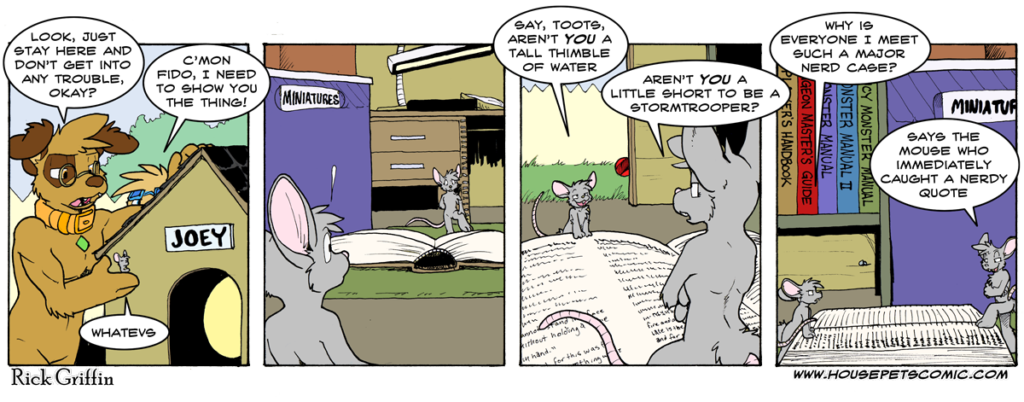
Identify the location of book. This screenshot has width=1024, height=402. (604, 281).